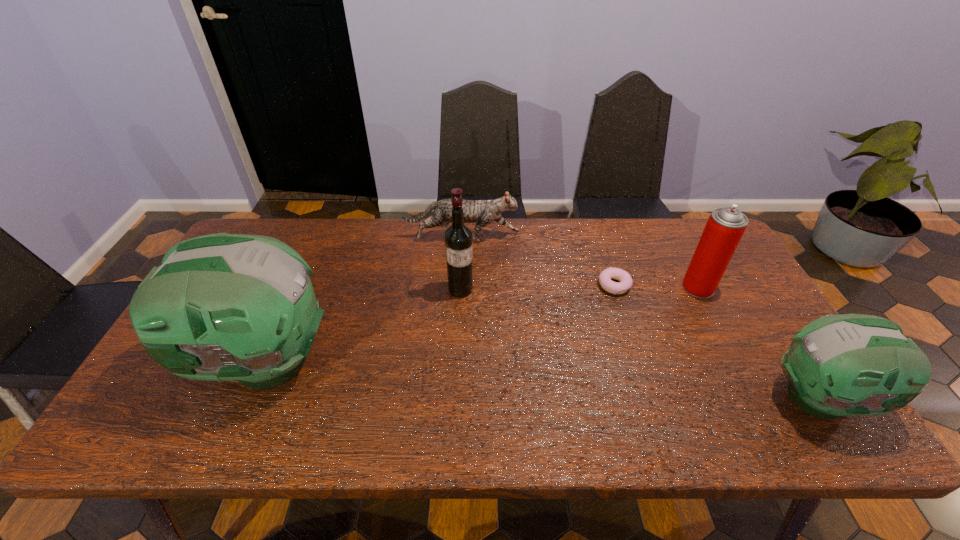
Find the location of a particular element. The width and height of the screenshot is (960, 540). empty space that is in between the right football helmet and the taller football helmet is located at coordinates tap(541, 380).

Image resolution: width=960 pixels, height=540 pixels. What are the coordinates of `vacant point located between the fourth shortest object and the third shortest object` in the screenshot? It's located at (760, 343).

Identify the location of empty space between the right football helmet and the fourth shortest object. This screenshot has height=540, width=960. (760, 343).

This screenshot has height=540, width=960. What are the coordinates of `blank region between the wine bottle and the taller football helmet` in the screenshot? It's located at (361, 326).

What are the coordinates of `the closest object to the wine bottle` in the screenshot? It's located at (483, 212).

Identify which object is the fourth closest to the shorter football helmet. Please provide its 2D coordinates. Your answer should be formatted as a tuple, i.e. [(x, y)], where the tuple contains the x and y coordinates of a point satisfying the conditions above.

[(458, 238)]

Locate an element on the screen. The width and height of the screenshot is (960, 540). free space that satisfies the following two spatial constraints: 1. on the face of the third object from right to left; 2. on the left side of the farthest object is located at coordinates (460, 286).

This screenshot has height=540, width=960. In order to click on free location that satisfies the following two spatial constraints: 1. on the face of the fifth tallest object; 2. on the back side of the aerosol can in this screenshot , I will do `click(460, 287)`.

This screenshot has width=960, height=540. What are the coordinates of `vacant region that satisfies the following two spatial constraints: 1. on the face of the farthest object; 2. on the left side of the fourth shortest object` in the screenshot? It's located at (460, 287).

Identify the location of free spot that satisfies the following two spatial constraints: 1. on the face of the farthest object; 2. on the back side of the aerosol can. (460, 287).